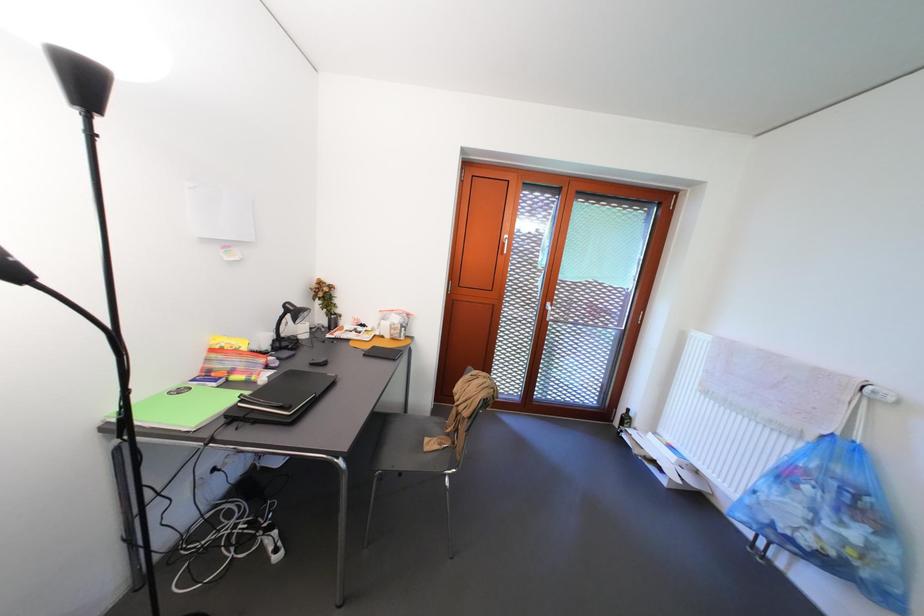
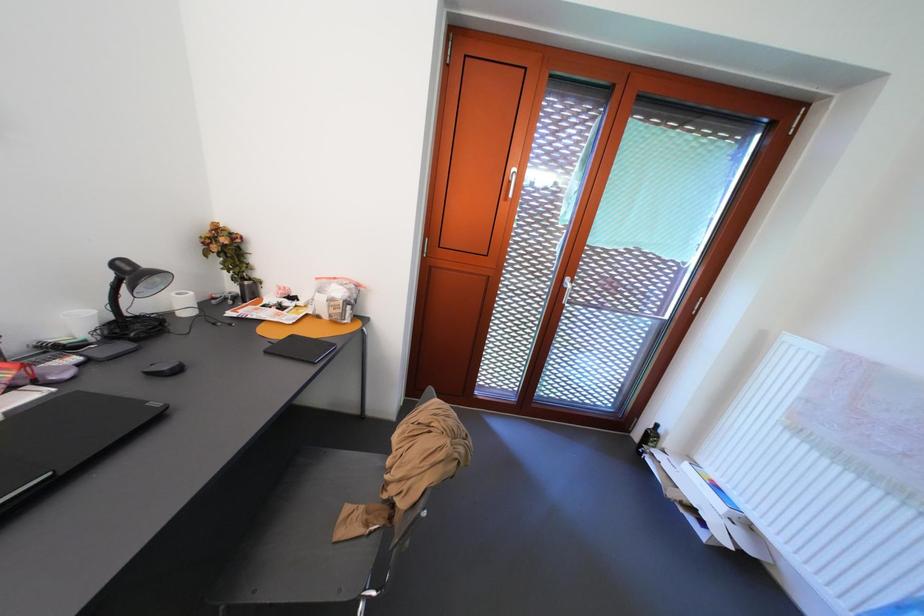
Question: How did the camera likely rotate?

Choices:
 (A) Left
 (B) Right
 (C) Up
 (D) Down

Answer: (D)